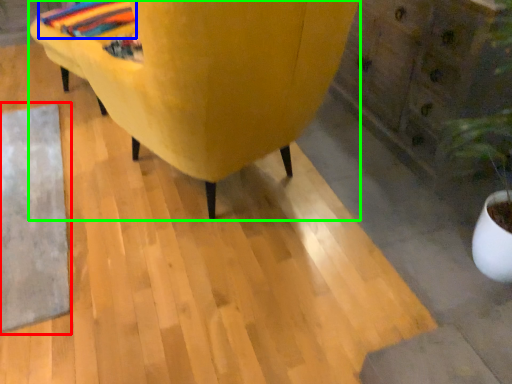
Question: Estimate the real-world distances between objects in this image. Which object is farther from mat (highlighted by a red box), blanket (highlighted by a blue box) or furniture (highlighted by a green box)?

Choices:
 (A) blanket
 (B) furniture

Answer: (A)